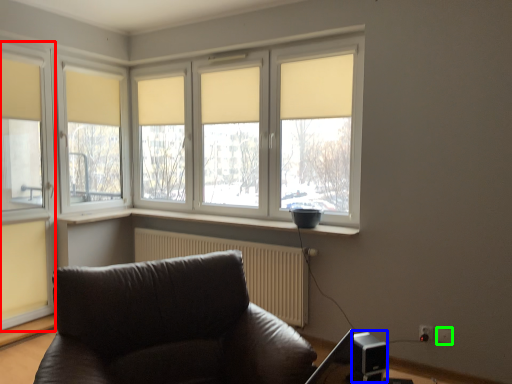
Question: Which object is positioned farthest from window (highlighted by a red box)? Select from speaker (highlighted by a blue box) and electric outlet (highlighted by a green box).

Choices:
 (A) speaker
 (B) electric outlet

Answer: (B)